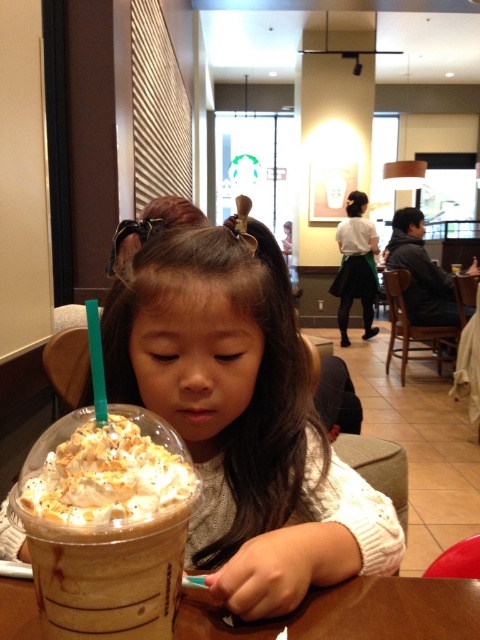
You are a customer in the cafe and want to place your phone on the table. The phone is 15 cm long. The table has a rectangular surface. The matte brown cupcake at center is located at coordinates 0.656, 0.506. Can you place your phone horizontally on the table without covering the cupcake?

The matte brown cupcake at center is located at coordinates (242, 419). Since the phone is 15 cm long and the table is rectangular, it depends on the table dimensions. However, the cupcake is at the center, so placing the phone around it should be possible as long as there is enough space on the table.

You are a customer in the cafe and want to place a napkin between the matte brown cupcake at center and the brown paper cup at center. According to the scene, which object should you move the napkin in front of or behind?

The matte brown cupcake at center is in front of the brown paper cup at center, so you should place the napkin behind the matte brown cupcake at center and in front of the brown paper cup at center.

You are a customer at the cafe and want to grab both the matte brown cupcake at center and the brown paper cup at center. Which one is closer to your right hand if you are sitting facing the center of the table?

The brown paper cup at center is closer to your right hand because the matte brown cupcake at center is to the left of it, placing the cup to the right side.